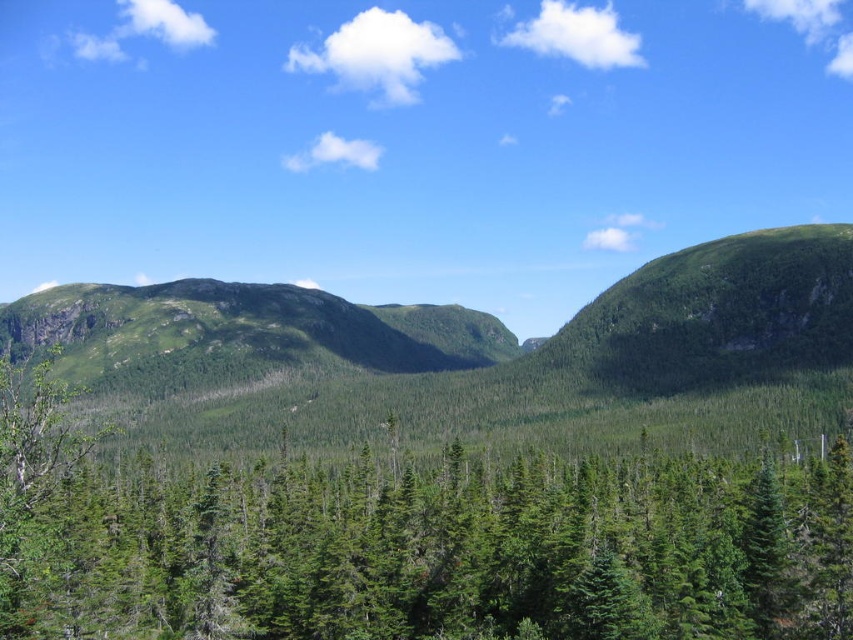
Question: Which object is closer to the camera taking this photo?

Choices:
 (A) green grassy mountain at center
 (B) green matte tree at center

Answer: (B)

Question: Which object is farther from the camera taking this photo?

Choices:
 (A) green matte tree at center
 (B) green grassy mountain at center

Answer: (B)

Question: Is green matte tree at center to the right of green grassy mountain at center from the viewer's perspective?

Choices:
 (A) no
 (B) yes

Answer: (A)

Question: Does green matte tree at center have a greater width compared to green grassy mountain at center?

Choices:
 (A) no
 (B) yes

Answer: (A)

Question: Which point appears closest to the camera in this image?

Choices:
 (A) (321, 508)
 (B) (776, 317)

Answer: (A)

Question: Can you confirm if green matte tree at center is thinner than green grassy mountain at center?

Choices:
 (A) yes
 (B) no

Answer: (A)